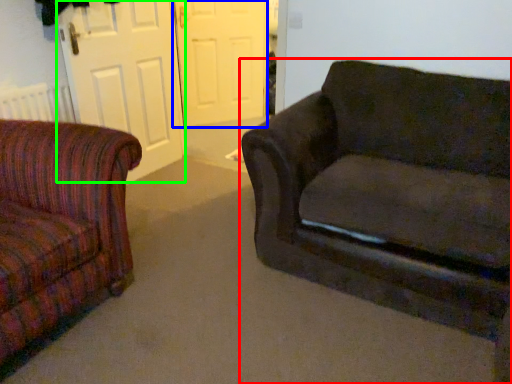
Question: Which object is positioned closest to studio couch (highlighted by a red box)? Select from screen door (highlighted by a blue box) and screen door (highlighted by a green box).

Choices:
 (A) screen door
 (B) screen door

Answer: (B)